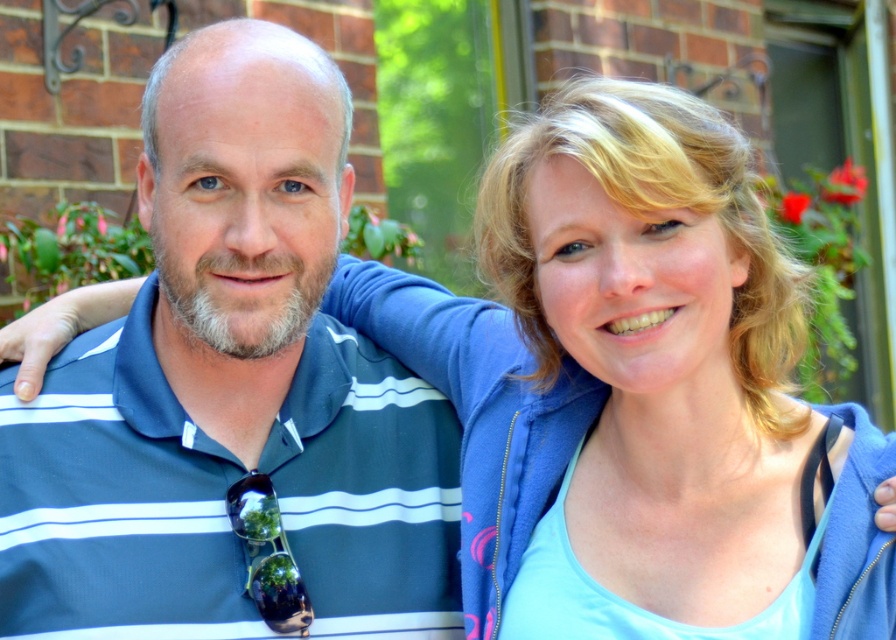
Does point (204, 420) lie in front of point (566, 291)?

No.

Can you confirm if blue striped polo shirt at left is positioned to the right of blonde hair at upper right?

In fact, blue striped polo shirt at left is to the left of blonde hair at upper right.

The image size is (896, 640). What do you see at coordinates (230, 388) in the screenshot? I see `blue striped polo shirt at left` at bounding box center [230, 388].

You are a GUI agent. You are given a task and a screenshot of the screen. Output one action in this format:
    pyautogui.click(x=<x>, y=<y>)
    Task: Click on the blue striped polo shirt at left
    
    Given the screenshot: What is the action you would take?
    click(x=230, y=388)